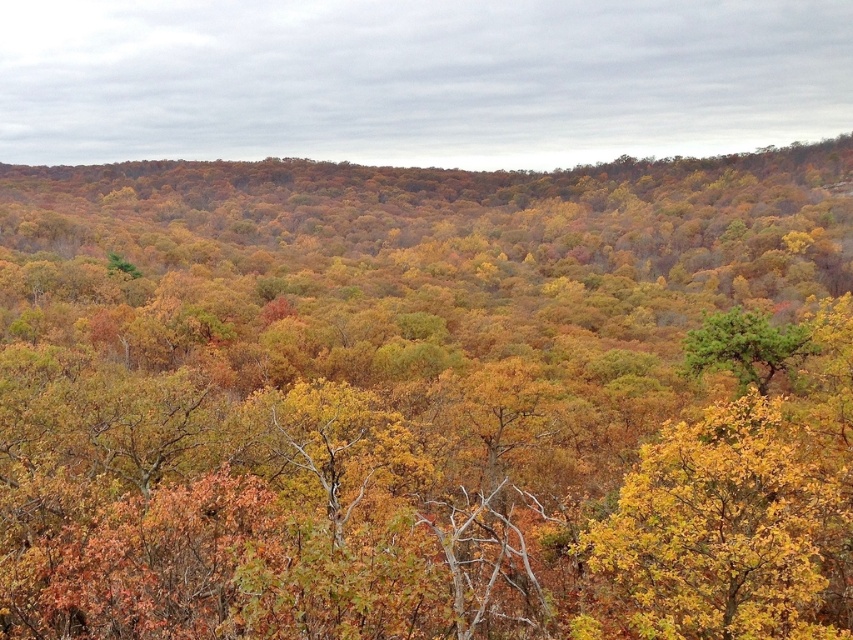
Based on the photo, you are standing in the forest and see a point marked at coordinates (730, 531). What color is the foliage at that point?

The foliage at point (730, 531) is yellowish green.